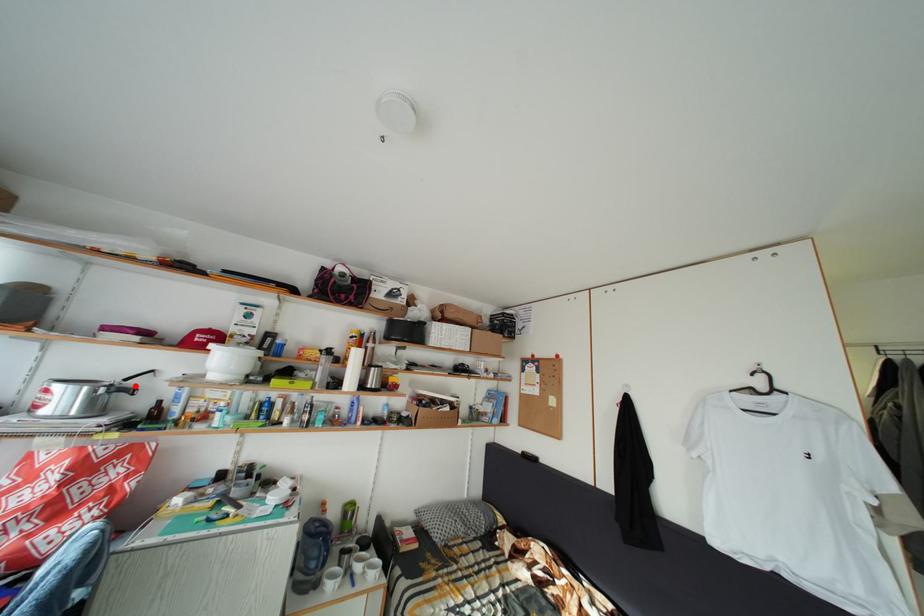
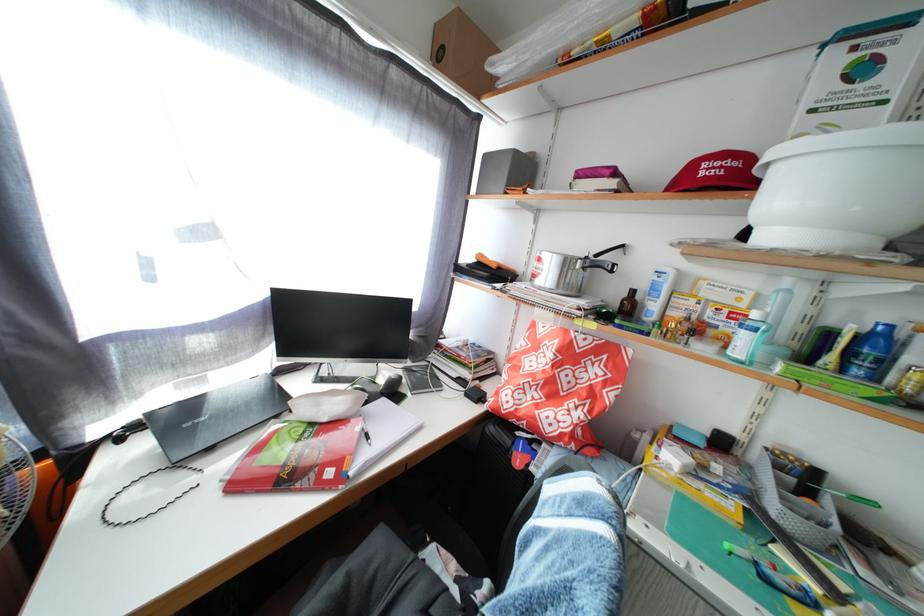
In the second image, find the point that corresponds to the highlighted location in the first image.

(605, 262)